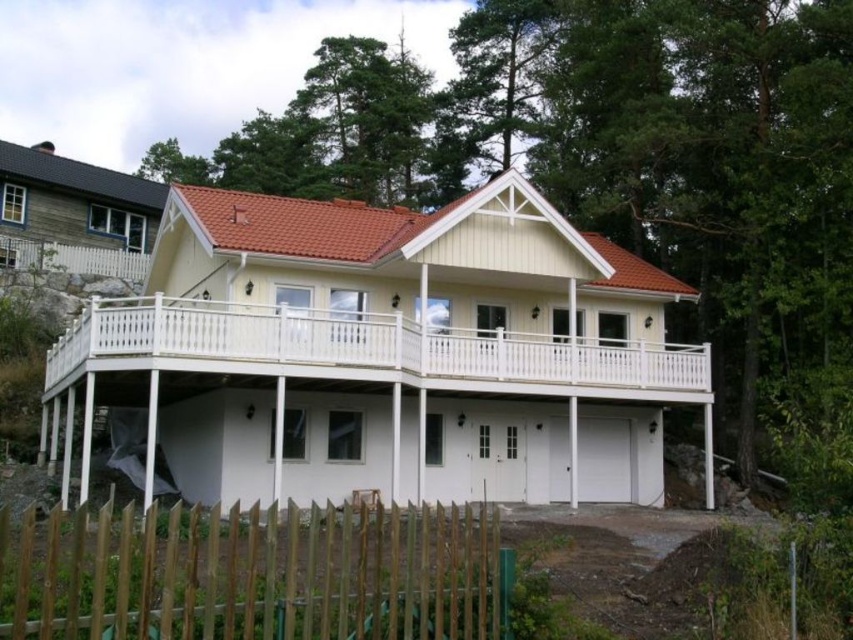
You are standing in front of the house and want to locate the white painted wood balcony at center. Based on the 2D coordinates given, where would you look relative to the center of the image?

The white painted wood balcony at center is located at coordinates approximately 0.555 on the x axis and 0.454 on the y axis, which is slightly to the right and slightly below the exact center of the image.

You are a delivery person with a 10 feet wide cart. You need to deliver a package to the house. The path between the white painted wood balcony at center and the brown wooden fence at lower left is your only route. Can your cart fit through the path?

The path between the white painted wood balcony at center and the brown wooden fence at lower left is 15.57 feet apart. Since your cart is 10 feet wide, it can fit through the path as the distance is greater than the cart width.